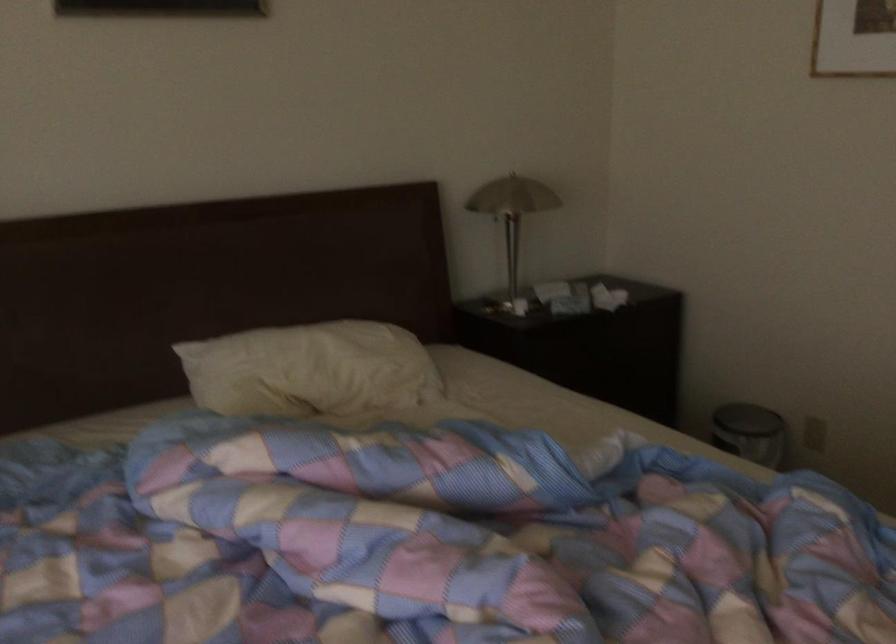
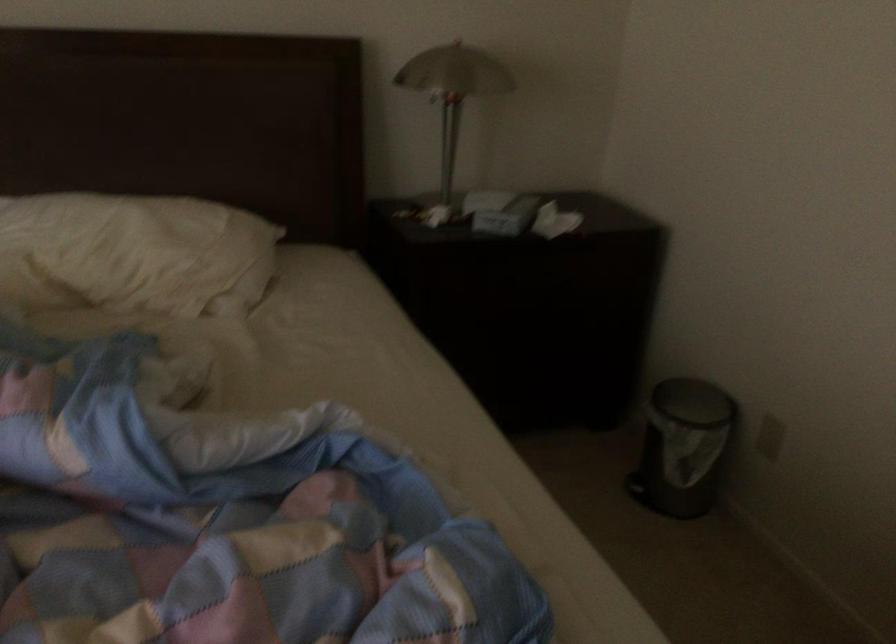
The point at (570, 292) is marked in the first image. Where is the corresponding point in the second image?

(501, 212)